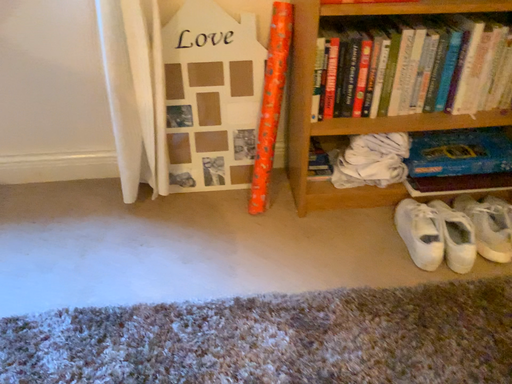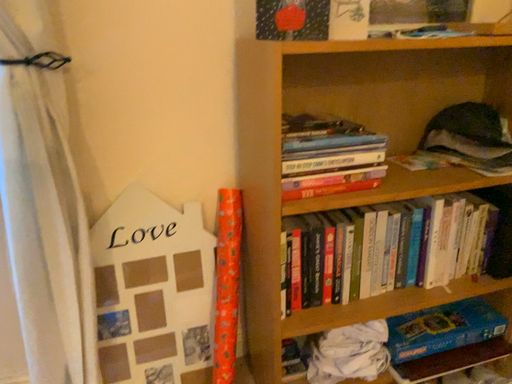
Question: Which way did the camera rotate in the video?

Choices:
 (A) rotated left
 (B) rotated right

Answer: (B)